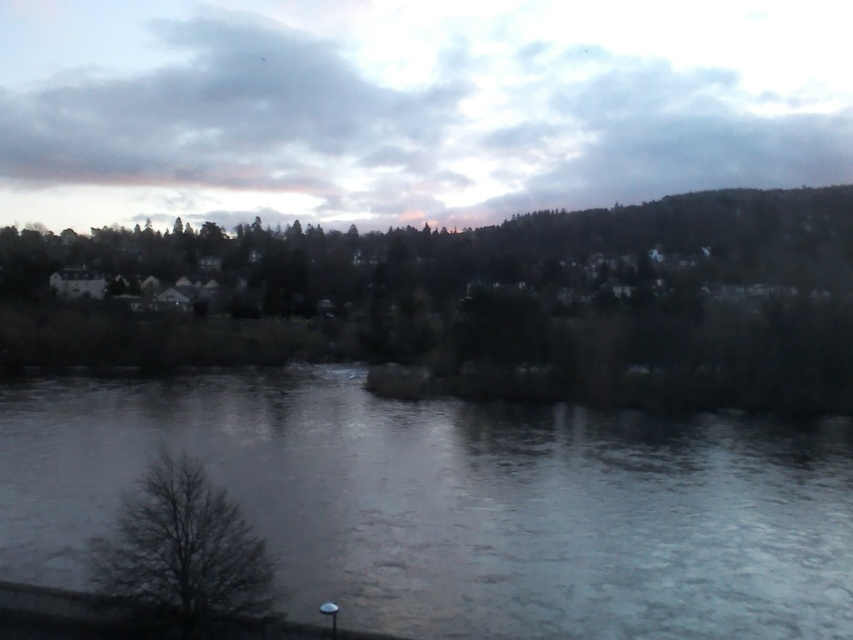
Question: Does green matte tree at center appear on the left side of bare branches at lower left?

Choices:
 (A) no
 (B) yes

Answer: (A)

Question: Considering the relative positions of green matte tree at center and bare branches at lower left in the image provided, where is green matte tree at center located with respect to bare branches at lower left?

Choices:
 (A) below
 (B) above

Answer: (B)

Question: Does gray ice at center have a smaller size compared to green matte tree at center?

Choices:
 (A) yes
 (B) no

Answer: (A)

Question: Which point appears farthest from the camera in this image?

Choices:
 (A) (219, 611)
 (B) (646, 609)

Answer: (B)

Question: Estimate the real-world distances between objects in this image. Which object is farther from the gray ice at center?

Choices:
 (A) bare branches at lower left
 (B) green matte tree at center

Answer: (B)

Question: Which point appears farthest from the camera in this image?

Choices:
 (A) (355, 332)
 (B) (177, 476)

Answer: (A)